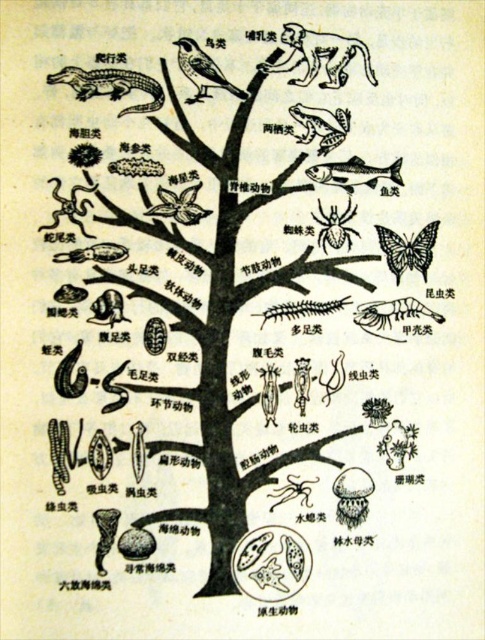
Question: Which object is farther from the camera taking this photo?

Choices:
 (A) black line drawing tree at center
 (B) shiny silver fish at upper right
 (C) smooth brown bird at center
 (D) greenish-brown scaly crocodile at upper left

Answer: (B)

Question: Where is black line drawing tree at center located in relation to smooth brown bird at center in the image?

Choices:
 (A) below
 (B) above

Answer: (A)

Question: Among these objects, which one is farthest from the camera?

Choices:
 (A) brown fur monkey at upper right
 (B) greenish-brown scaly crocodile at upper left

Answer: (A)

Question: Which is farther from the greenish-brown scaly crocodile at upper left?

Choices:
 (A) brown fur monkey at upper right
 (B) shiny silver fish at upper right

Answer: (B)

Question: Is shiny silver fish at upper right to the right of smooth brown bird at center from the viewer's perspective?

Choices:
 (A) yes
 (B) no

Answer: (A)

Question: Does greenish-brown scaly crocodile at upper left have a greater width compared to shiny silver fish at upper right?

Choices:
 (A) yes
 (B) no

Answer: (A)